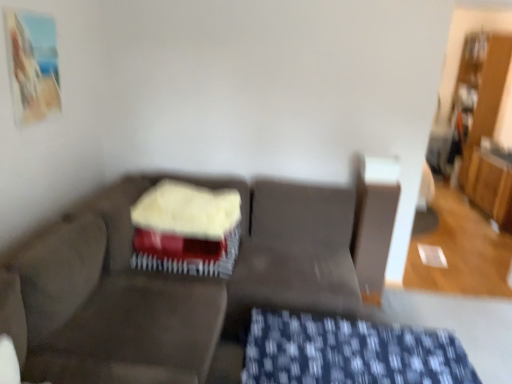
Question: Would you say dark gray fabric couch at center is a long distance from blue textured fabric at lower center?

Choices:
 (A) no
 (B) yes

Answer: (A)

Question: Is blue textured fabric at lower center inside dark gray fabric couch at center?

Choices:
 (A) yes
 (B) no

Answer: (A)

Question: From the image's perspective, is dark gray fabric couch at center located above blue textured fabric at lower center?

Choices:
 (A) yes
 (B) no

Answer: (A)

Question: Can you confirm if dark gray fabric couch at center is positioned to the right of blue textured fabric at lower center?

Choices:
 (A) no
 (B) yes

Answer: (A)

Question: Is dark gray fabric couch at center positioned beyond the bounds of blue textured fabric at lower center?

Choices:
 (A) yes
 (B) no

Answer: (A)

Question: Is blue textured fabric at lower center at the back of dark gray fabric couch at center?

Choices:
 (A) yes
 (B) no

Answer: (B)

Question: Is smooth red cake at center oriented towards dark gray fabric couch at center?

Choices:
 (A) yes
 (B) no

Answer: (A)

Question: From a real-world perspective, is smooth red cake at center under dark gray fabric couch at center?

Choices:
 (A) yes
 (B) no

Answer: (B)

Question: Is smooth red cake at center bigger than dark gray fabric couch at center?

Choices:
 (A) no
 (B) yes

Answer: (A)

Question: From a real-world perspective, is smooth red cake at center physically above dark gray fabric couch at center?

Choices:
 (A) no
 (B) yes

Answer: (B)

Question: Is smooth red cake at center far from dark gray fabric couch at center?

Choices:
 (A) yes
 (B) no

Answer: (B)

Question: Is smooth red cake at center at the left side of dark gray fabric couch at center?

Choices:
 (A) yes
 (B) no

Answer: (A)

Question: Considering the relative sizes of blue textured fabric at lower center and velvet-like beige swivel chair at center in the image provided, is blue textured fabric at lower center smaller than velvet-like beige swivel chair at center?

Choices:
 (A) yes
 (B) no

Answer: (A)